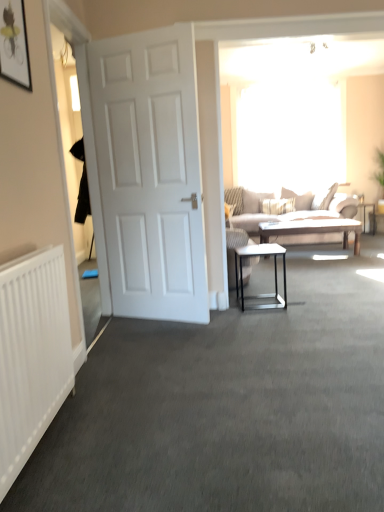
Question: Are white glossy side table at center and metallic silver side table at right beside each other?

Choices:
 (A) no
 (B) yes

Answer: (A)

Question: Would you say metallic silver side table at right is part of white glossy side table at center's contents?

Choices:
 (A) yes
 (B) no

Answer: (B)

Question: Does white glossy side table at center have a greater width compared to metallic silver side table at right?

Choices:
 (A) yes
 (B) no

Answer: (B)

Question: From the image's perspective, is white glossy side table at center above metallic silver side table at right?

Choices:
 (A) yes
 (B) no

Answer: (B)

Question: Considering the relative positions of white glossy side table at center and metallic silver side table at right in the image provided, is white glossy side table at center to the right of metallic silver side table at right from the viewer's perspective?

Choices:
 (A) no
 (B) yes

Answer: (A)

Question: Is white glossy side table at center taller than metallic silver side table at right?

Choices:
 (A) yes
 (B) no

Answer: (B)

Question: Can you confirm if metallic silver side table at right is positioned to the right of wooden polished coffee table at center?

Choices:
 (A) yes
 (B) no

Answer: (A)

Question: Is metallic silver side table at right positioned in front of wooden polished coffee table at center?

Choices:
 (A) yes
 (B) no

Answer: (B)

Question: Does metallic silver side table at right come behind wooden polished coffee table at center?

Choices:
 (A) yes
 (B) no

Answer: (A)

Question: From the image's perspective, does metallic silver side table at right appear higher than wooden polished coffee table at center?

Choices:
 (A) no
 (B) yes

Answer: (B)

Question: Is metallic silver side table at right oriented away from wooden polished coffee table at center?

Choices:
 (A) yes
 (B) no

Answer: (B)

Question: Considering the relative sizes of metallic silver side table at right and wooden polished coffee table at center in the image provided, is metallic silver side table at right wider than wooden polished coffee table at center?

Choices:
 (A) no
 (B) yes

Answer: (A)

Question: Is metallic silver side table at right located within white matte door at left?

Choices:
 (A) no
 (B) yes

Answer: (A)